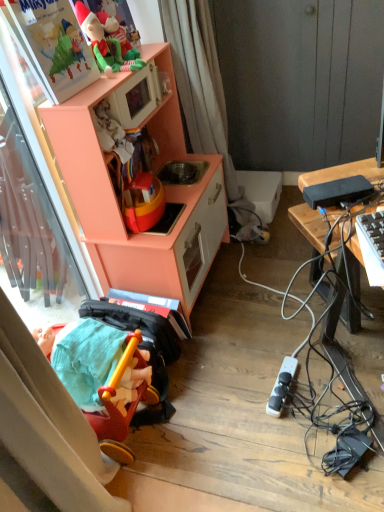
Locate an element on the screen. free point to the right of black plastic power strip at lower right, acting as the 2th appliance starting from the front is located at coordinates (319, 379).